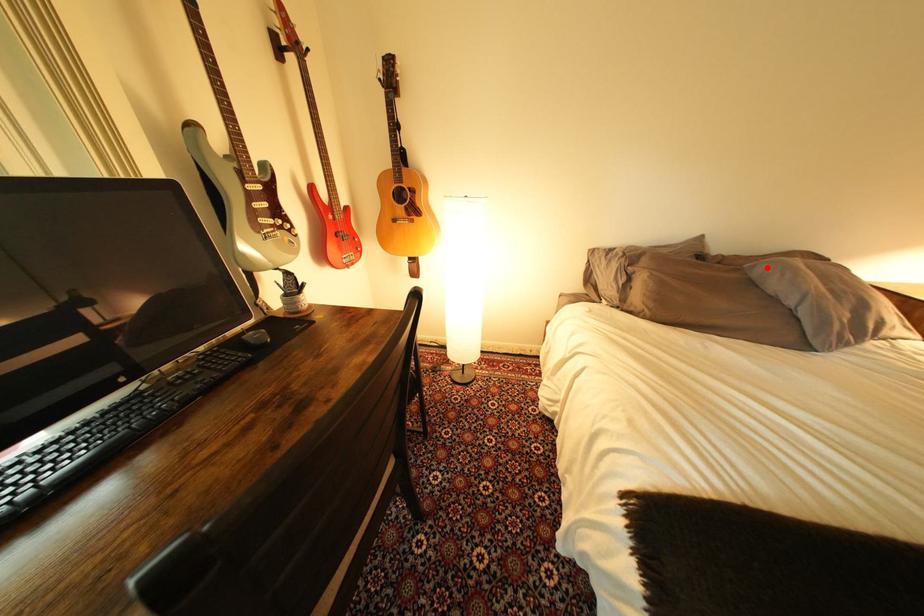
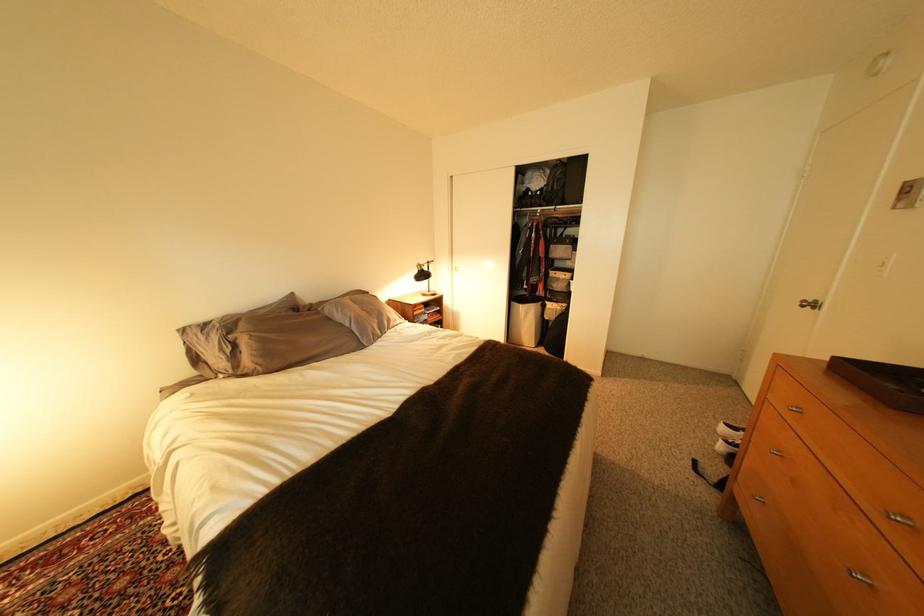
The point at the highlighted location is marked in the first image. Where is the corresponding point in the second image?

(335, 310)